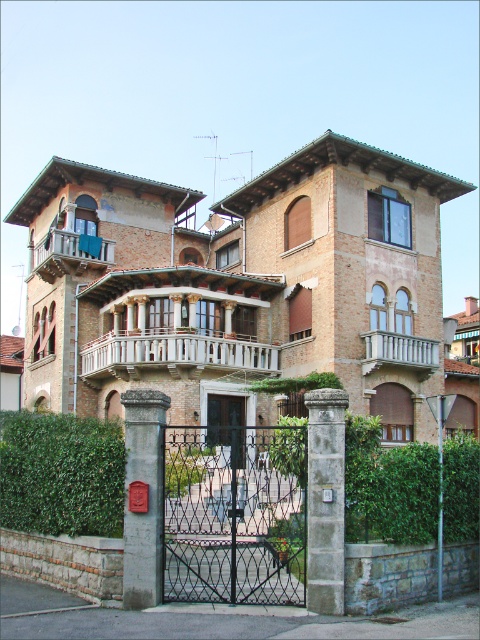
You are a delivery person approaching the stone gate post at center and the white wooden balcony at upper center. Which object is closer to the entrance of the building?

The stone gate post at center is closer to the entrance of the building because it is positioned on the left side of the white wooden balcony at upper center, which is located higher up on the building.

Based on the photo, you are a visitor approaching the residential building and want to enter through the entrance. The entrance is located at the center of the building. Which object must you pass through first, the black wrought iron gate at center or the stone gate post at center?

You must pass through the black wrought iron gate at center first because it is positioned under the stone gate post at center, meaning it is closer to the entrance.

Looking at this image, you are a visitor approaching the building and want to enter through the main entrance. Which object would you pass first, the stone gate post at center or the white wooden balcony at center?

The stone gate post at center is below the white wooden balcony at center, so you would pass the stone gate post at center first as it is closer to the ground level.